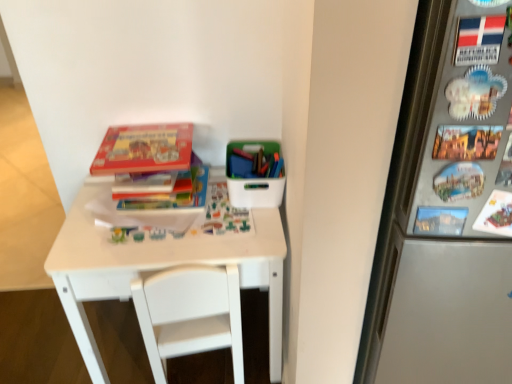
Question: Is white matte table at center positioned with its back to white plastic chair at center?

Choices:
 (A) no
 (B) yes

Answer: (B)

Question: From a real-world perspective, is white matte table at center positioned over white plastic chair at center based on gravity?

Choices:
 (A) yes
 (B) no

Answer: (A)

Question: Does white matte table at center touch white plastic chair at center?

Choices:
 (A) yes
 (B) no

Answer: (A)

Question: Does white matte table at center have a lesser width compared to white plastic chair at center?

Choices:
 (A) yes
 (B) no

Answer: (B)

Question: From a real-world perspective, does white matte table at center sit lower than white plastic chair at center?

Choices:
 (A) no
 (B) yes

Answer: (A)

Question: Considering the positions of hardcover book at center, the second book when ordered from top to bottom, and matte cardboard book at upper left, the 1th book viewed from the top, in the image, is hardcover book at center, the second book when ordered from top to bottom, wider or thinner than matte cardboard book at upper left, the 1th book viewed from the top,?

Choices:
 (A) wide
 (B) thin

Answer: (B)

Question: From a real-world perspective, is hardcover book at center, which ranks as the first book in bottom-to-top order, above or below matte cardboard book at upper left, the 1th book viewed from the top?

Choices:
 (A) above
 (B) below

Answer: (B)

Question: Considering the positions of hardcover book at center, the second book when ordered from top to bottom, and matte cardboard book at upper left, the 1th book viewed from the top, in the image, is hardcover book at center, the second book when ordered from top to bottom, taller or shorter than matte cardboard book at upper left, the 1th book viewed from the top,?

Choices:
 (A) short
 (B) tall

Answer: (B)

Question: In the image, is hardcover book at center, the second book when ordered from top to bottom, on the left side or the right side of matte cardboard book at upper left, acting as the second book starting from the bottom?

Choices:
 (A) right
 (B) left

Answer: (A)

Question: Is white plastic container at upper right in front of or behind white plastic chair at center in the image?

Choices:
 (A) behind
 (B) front

Answer: (A)

Question: Is point (227, 165) closer or farther from the camera than point (243, 379)?

Choices:
 (A) farther
 (B) closer

Answer: (A)

Question: Is white plastic container at upper right taller or shorter than white plastic chair at center?

Choices:
 (A) short
 (B) tall

Answer: (A)

Question: From the image's perspective, is white plastic container at upper right above or below white plastic chair at center?

Choices:
 (A) above
 (B) below

Answer: (A)

Question: Is white plastic container at upper right to the left or to the right of hardcover book at center, which ranks as the first book in bottom-to-top order, in the image?

Choices:
 (A) right
 (B) left

Answer: (A)

Question: In the image, is white plastic container at upper right positioned in front of or behind hardcover book at center, which ranks as the first book in bottom-to-top order?

Choices:
 (A) front
 (B) behind

Answer: (A)